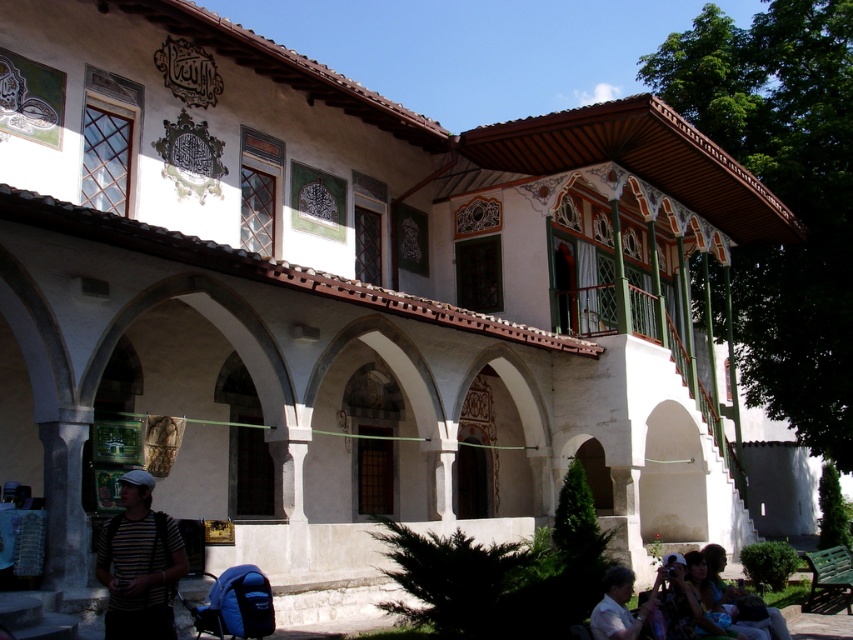
Question: Is striped fabric shirt at lower left below light brown leather jacket at lower right?

Choices:
 (A) no
 (B) yes

Answer: (A)

Question: Estimate the real-world distances between objects in this image. Which object is closer to the light brown leather jacket at lower right?

Choices:
 (A) striped fabric shirt at lower left
 (B) matte black shirt at lower right

Answer: (B)

Question: Which is nearer to the light brown leather jacket at lower right?

Choices:
 (A) matte black shirt at lower right
 (B) striped fabric shirt at lower left

Answer: (A)

Question: Can you confirm if light brown leather jacket at lower right is thinner than matte black shirt at lower right?

Choices:
 (A) no
 (B) yes

Answer: (B)

Question: Observing the image, what is the correct spatial positioning of striped fabric shirt at lower left in reference to light brown leather jacket at lower right?

Choices:
 (A) below
 (B) above

Answer: (B)

Question: Based on their relative distances, which object is nearer to the light brown leather jacket at lower right?

Choices:
 (A) matte black shirt at lower right
 (B) striped fabric shirt at lower left

Answer: (A)